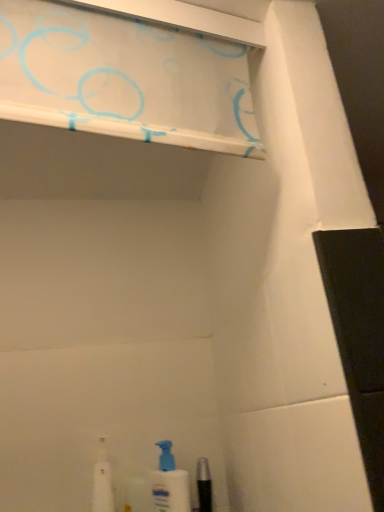
Question: Considering the relative sizes of white plastic bottle at lower left and white glossy shelf at upper center in the image provided, is white plastic bottle at lower left wider than white glossy shelf at upper center?

Choices:
 (A) no
 (B) yes

Answer: (B)

Question: Is white plastic bottle at lower left bigger than white glossy shelf at upper center?

Choices:
 (A) no
 (B) yes

Answer: (A)

Question: Is white plastic bottle at lower left positioned before white glossy shelf at upper center?

Choices:
 (A) no
 (B) yes

Answer: (A)

Question: Is white plastic bottle at lower left at the right side of white glossy shelf at upper center?

Choices:
 (A) no
 (B) yes

Answer: (A)

Question: From a real-world perspective, is white plastic bottle at lower left located beneath white glossy shelf at upper center?

Choices:
 (A) no
 (B) yes

Answer: (B)

Question: Considering the positions of white glossy shelf at upper center and white plastic spray bottle at lower center in the image, is white glossy shelf at upper center bigger or smaller than white plastic spray bottle at lower center?

Choices:
 (A) small
 (B) big

Answer: (B)

Question: In the image, is white glossy shelf at upper center on the left side or the right side of white plastic spray bottle at lower center?

Choices:
 (A) right
 (B) left

Answer: (B)

Question: Relative to white plastic spray bottle at lower center, is white glossy shelf at upper center in front or behind?

Choices:
 (A) front
 (B) behind

Answer: (A)

Question: Is white glossy shelf at upper center inside or outside of white plastic spray bottle at lower center?

Choices:
 (A) inside
 (B) outside

Answer: (B)

Question: Considering the positions of point coord(107,480) and point coord(8,109), is point coord(107,480) closer or farther from the camera than point coord(8,109)?

Choices:
 (A) farther
 (B) closer

Answer: (A)

Question: Is white plastic bottle at lower left bigger or smaller than white glossy shelf at upper center?

Choices:
 (A) small
 (B) big

Answer: (A)

Question: From the image's perspective, relative to white glossy shelf at upper center, is white plastic bottle at lower left above or below?

Choices:
 (A) below
 (B) above

Answer: (A)

Question: Considering the relative positions of white plastic bottle at lower left and white glossy shelf at upper center in the image provided, is white plastic bottle at lower left to the left or to the right of white glossy shelf at upper center?

Choices:
 (A) left
 (B) right

Answer: (A)

Question: Considering the relative positions of white plastic spray bottle at lower center and white glossy shelf at upper center in the image provided, is white plastic spray bottle at lower center to the left or to the right of white glossy shelf at upper center?

Choices:
 (A) left
 (B) right

Answer: (B)

Question: Considering the positions of white plastic spray bottle at lower center and white glossy shelf at upper center in the image, is white plastic spray bottle at lower center taller or shorter than white glossy shelf at upper center?

Choices:
 (A) tall
 (B) short

Answer: (A)